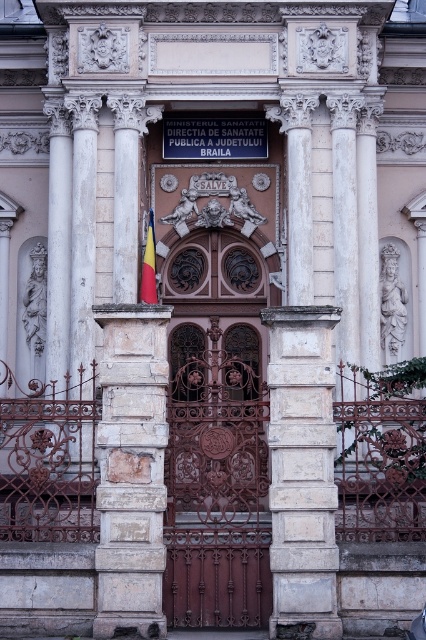
Between white stone column at left and white stone column at center, which one appears on the left side from the viewer's perspective?

From the viewer's perspective, white stone column at left appears more on the left side.

Between point (138, 352) and point (304, 212), which one is positioned behind?

The point (304, 212) is behind.

Locate an element on the screen. white stone column at left is located at coordinates (131, 410).

Who is lower down, white stone column at center or polished wood flag at center?

white stone column at center is lower down.

Is white stone column at center taller than polished wood flag at center?

Correct, white stone column at center is much taller as polished wood flag at center.

Is point (311, 289) positioned after point (141, 291)?

Yes.

The width and height of the screenshot is (426, 640). In order to click on white stone column at center in this screenshot , I will do `click(301, 410)`.

Can you confirm if white stone column at left is thinner than polished wood flag at center?

Incorrect, white stone column at left's width is not less than polished wood flag at center's.

Which is behind, point (143, 131) or point (147, 275)?

Positioned behind is point (143, 131).

Where is `white stone column at left`? The height and width of the screenshot is (640, 426). white stone column at left is located at coordinates (131, 410).

Find the location of a particular element. This screenshot has height=640, width=426. white stone column at left is located at coordinates (131, 410).